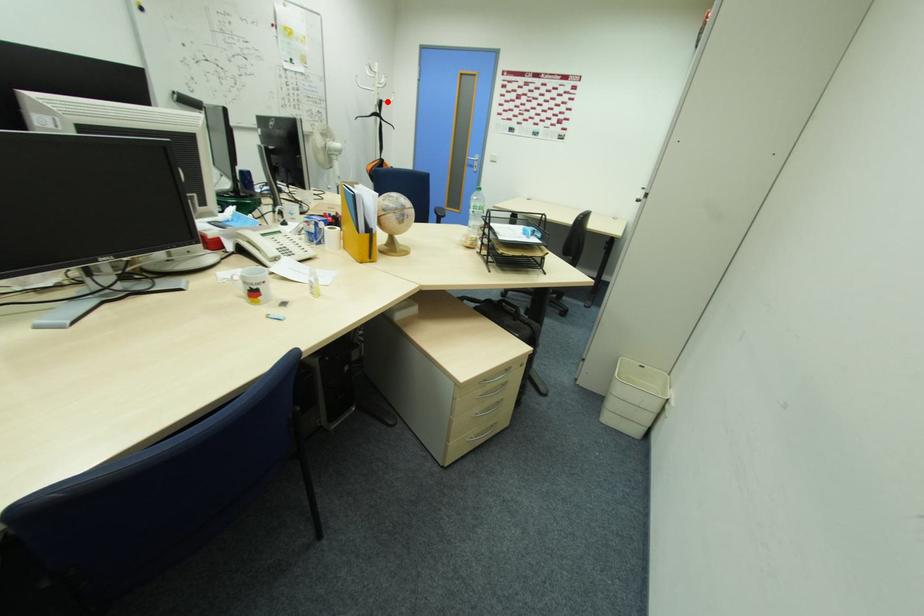
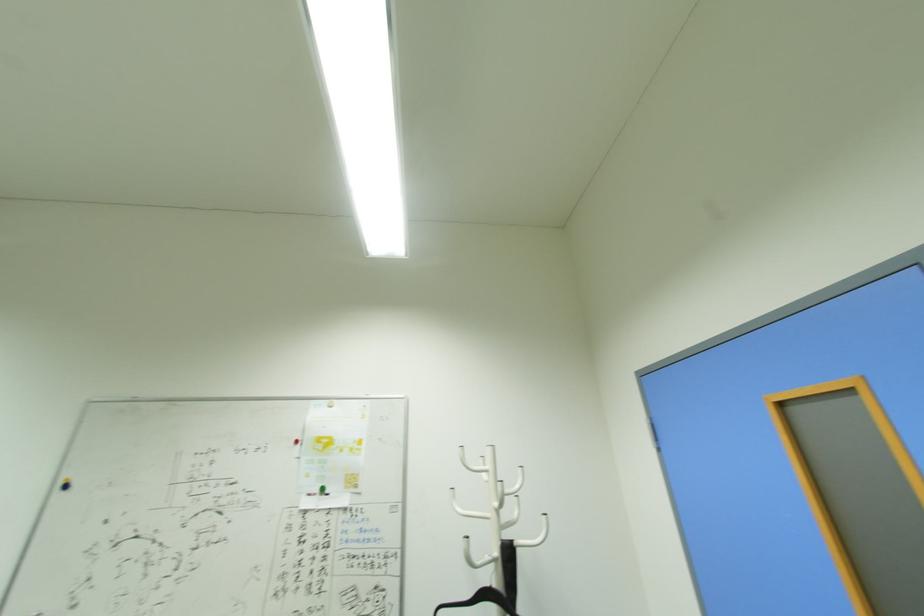
Question: I am providing you with two images of the same scene from different viewpoints. Given a red point in image1, look at the same physical point in image2. Is it:

Choices:
 (A) Closer to the viewpoint
 (B) Farther from the viewpoint

Answer: (B)